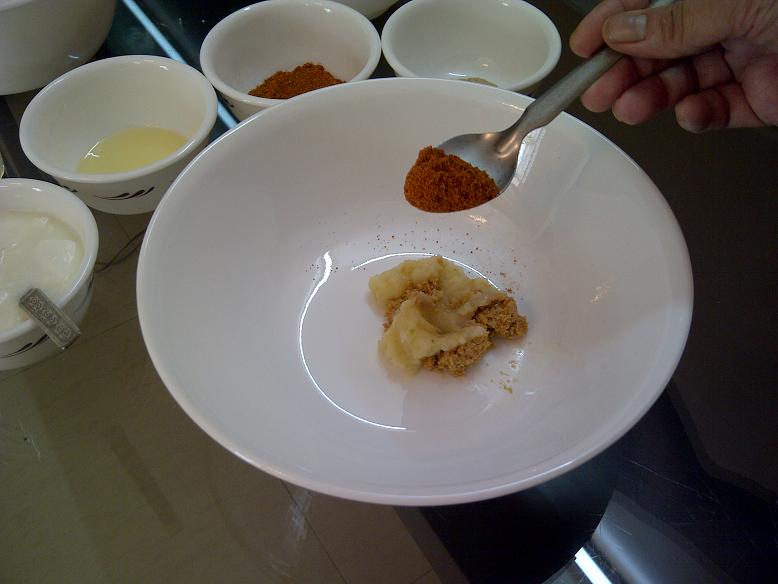
Locate an element on the screen. The image size is (778, 584). spoon handle is located at coordinates (559, 102).